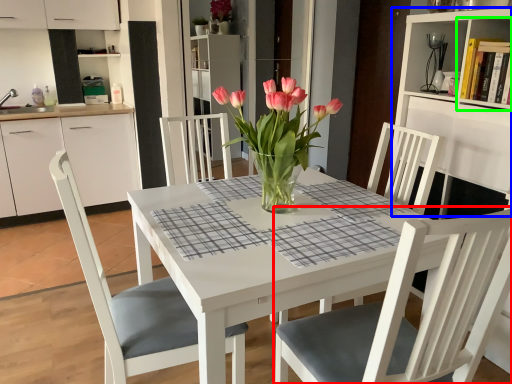
Question: Based on their relative distances, which object is nearer to chair (highlighted by a red box)? Choose from bookshelf (highlighted by a blue box) and shelf (highlighted by a green box).

Choices:
 (A) bookshelf
 (B) shelf

Answer: (A)